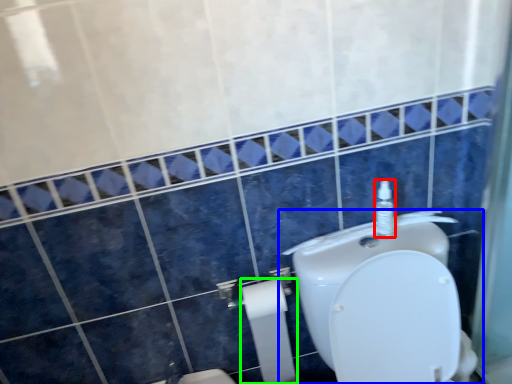
Question: Which object is the closest to the soap dispenser (highlighted by a red box)? Choose among these: toilet (highlighted by a blue box) or toilet paper (highlighted by a green box).

Choices:
 (A) toilet
 (B) toilet paper

Answer: (A)